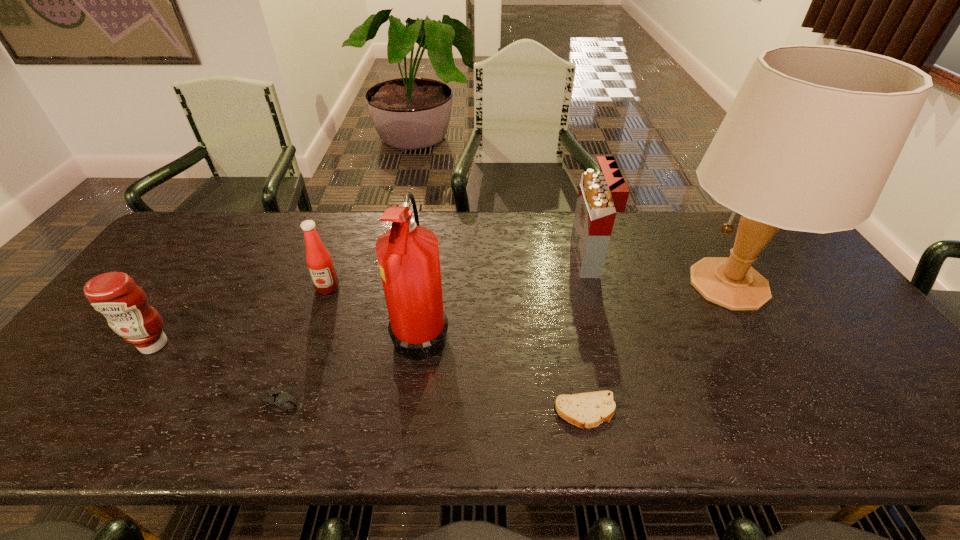
Identify which object is the nearest to the left condiment. Please provide its 2D coordinates. Your answer should be formatted as a tuple, i.e. [(x, y)], where the tuple contains the x and y coordinates of a point satisfying the conditions above.

[(280, 401)]

Identify the location of object that can be found as the fourth closest to the table lamp. Image resolution: width=960 pixels, height=540 pixels. (318, 259).

The height and width of the screenshot is (540, 960). I want to click on vacant space that satisfies the following two spatial constraints: 1. with the lid open on the fifth shortest object; 2. on the left side of the rightmost object, so click(595, 284).

You are a GUI agent. You are given a task and a screenshot of the screen. Output one action in this format:
    pyautogui.click(x=<x>, y=<y>)
    Task: Click on the free space that satisfies the following two spatial constraints: 1. at the spray nozzle of the pita bread; 2. on the right side of the fourth object from left to right
    Image resolution: width=960 pixels, height=540 pixels.
    Given the screenshot: What is the action you would take?
    (411, 411)

Identify the location of free spot that satisfies the following two spatial constraints: 1. at the spray nozzle of the sixth shortest object; 2. on the right side of the pita bread. (411, 411).

This screenshot has height=540, width=960. What are the coordinates of `blank area in the image that satisfies the following two spatial constraints: 1. at the spray nozzle of the fire extinguisher; 2. on the left side of the pita bread` in the screenshot? It's located at (411, 411).